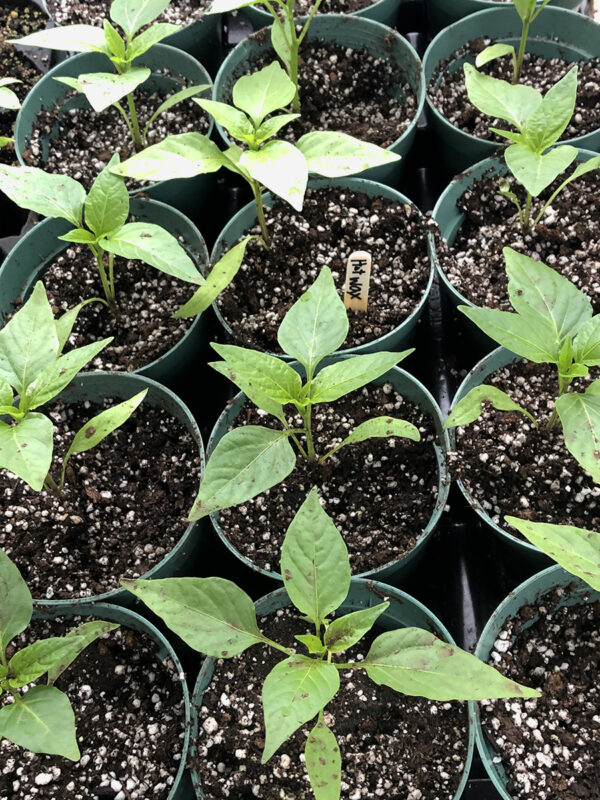
The image size is (600, 800). In order to click on pot in bottom left corner of image in this screenshot , I will do `click(146, 621)`.